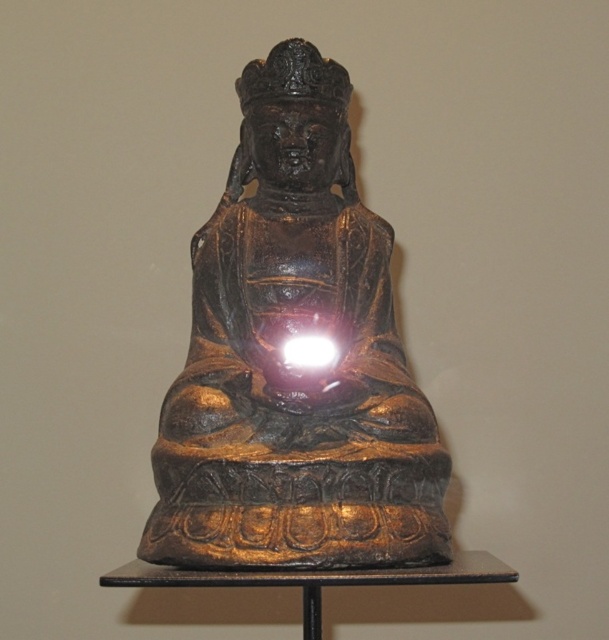
Is point (364, 337) farther from camera compared to point (308, 340)?

Yes.

Consider the image. Does gold-bronze statue at center have a lesser height compared to bright white light at center?

No.

Is point (189, 406) positioned behind point (314, 344)?

No, (189, 406) is in front of (314, 344).

Locate an element on the screen. gold-bronze statue at center is located at coordinates (290, 369).